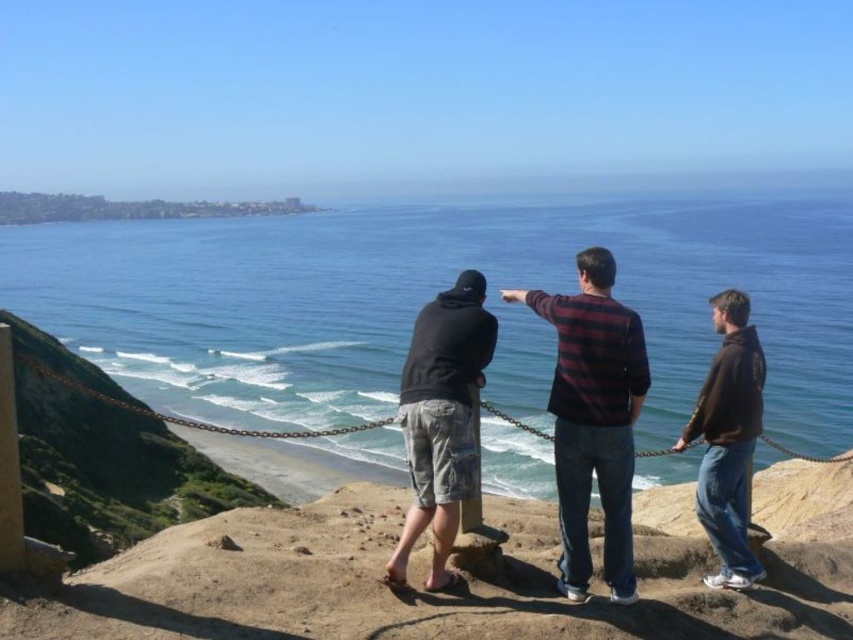
You are a photographer trying to capture the scenic coastal view. You want to position yourself such that the striped sweater at center is in the center of your photo frame. What coordinate should you aim for?

The striped sweater at center is located at coordinate point (593,419), so you should aim for that coordinate to center it in your photo frame.

You are standing at the cliff overlooking the ocean and see two points marked in the scene. The first point is at coordinates point (485,356) and the second is at point (697,442). Which of these two points is closer to your current position?

Point (485,356) is closer to the viewer than point (697,442).

You are standing at the cliff overlooking the ocean and want to reach the point marked at coordinates point (440, 461). If your maximum walking distance is 15 meters, can you safely reach that point without exceeding your limit?

The distance of point (440, 461) from the camera is 13.57 meters, so yes, you can safely reach that point since it is within your 15 meters limit.